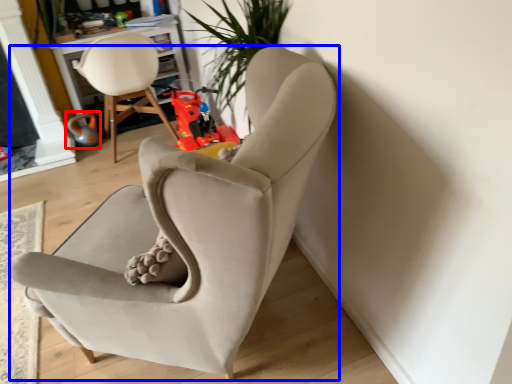
Question: Which object is closer to the camera taking this photo, toy (highlighted by a red box) or chair (highlighted by a blue box)?

Choices:
 (A) toy
 (B) chair

Answer: (B)